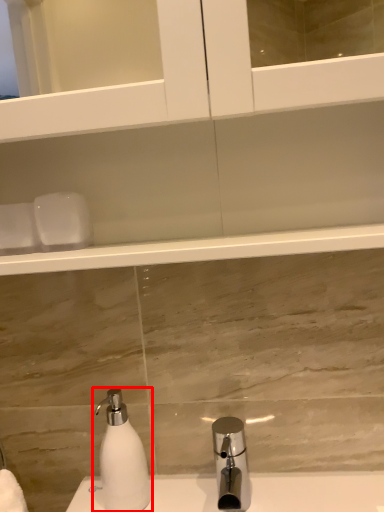
Question: From the image's perspective, where is soap dispenser (annotated by the red box) located in relation to tap in the image?

Choices:
 (A) below
 (B) above

Answer: (B)